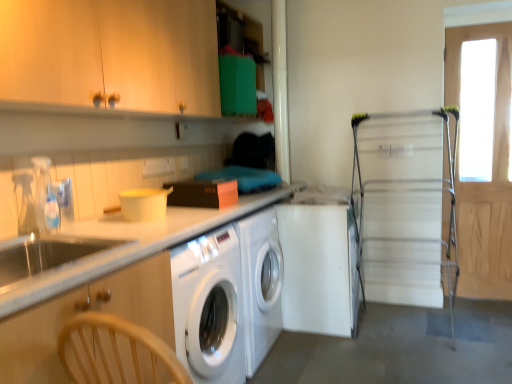
What do you see at coordinates (319, 262) in the screenshot? I see `white matte washing machine at center` at bounding box center [319, 262].

Where is `white glossy countertop at left`? white glossy countertop at left is located at coordinates (128, 246).

Where is `wooden cabinet at upper left, which is the first cabinetry from top to bottom`? This screenshot has height=384, width=512. wooden cabinet at upper left, which is the first cabinetry from top to bottom is located at coordinates (111, 53).

Measure the distance between wooden cabinet at upper left, which is the first cabinetry from top to bottom, and camera.

wooden cabinet at upper left, which is the first cabinetry from top to bottom, is 4.14 feet away from camera.

Describe the element at coordinates (88, 309) in the screenshot. I see `wooden cabinet at left, marked as the second cabinetry in a top-to-bottom arrangement` at that location.

This screenshot has height=384, width=512. What do you see at coordinates (484, 182) in the screenshot?
I see `wooden screen door at right, placed as the second screen door when sorted from left to right` at bounding box center [484, 182].

I want to click on clear plastic faucet at left, so click(x=45, y=197).

Would you consider white glossy countertop at left to be distant from white matte washing machine at center?

No, there isn't a large distance between white glossy countertop at left and white matte washing machine at center.

Is white glossy countertop at left facing towards white matte washing machine at center?

No, white glossy countertop at left does not turn towards white matte washing machine at center.

Does point (53, 281) appear closer or farther from the camera than point (340, 302)?

Point (53, 281) appears to be closer to the viewer than point (340, 302).

Which is behind, white glossy countertop at left or white matte washing machine at center?

white matte washing machine at center is more distant.

Is wooden cabinet at upper left, which is the first cabinetry from top to bottom, looking in the opposite direction of white matte washing machine at center?

No, white matte washing machine at center is not at the back of wooden cabinet at upper left, which is the first cabinetry from top to bottom.

From the picture: From the image's perspective, which one is positioned higher, wooden cabinet at upper left, acting as the second cabinetry starting from the bottom, or white matte washing machine at center?

wooden cabinet at upper left, acting as the second cabinetry starting from the bottom, appears higher in the image.

From a real-world perspective, who is located higher, wooden cabinet at upper left, acting as the second cabinetry starting from the bottom, or white matte washing machine at center?

wooden cabinet at upper left, acting as the second cabinetry starting from the bottom.

Can metallic silver drying rack at right, which appears as the second screen door when viewed from the right, be found inside wooden cabinet at upper left, which is the first cabinetry from top to bottom?

No, metallic silver drying rack at right, which appears as the second screen door when viewed from the right, is located outside of wooden cabinet at upper left, which is the first cabinetry from top to bottom.

Which object is closer to the camera, wooden cabinet at upper left, which is the first cabinetry from top to bottom, or metallic silver drying rack at right, placed as the 1th screen door when sorted from left to right?

wooden cabinet at upper left, which is the first cabinetry from top to bottom, is more forward.

Does clear plastic faucet at left have a greater width compared to white glossy countertop at left?

Incorrect, the width of clear plastic faucet at left does not surpass that of white glossy countertop at left.

Between clear plastic faucet at left and white glossy countertop at left, which one has smaller size?

Smaller between the two is clear plastic faucet at left.

From the image's perspective, is clear plastic faucet at left located above white glossy countertop at left?

Correct, clear plastic faucet at left appears higher than white glossy countertop at left in the image.

Is clear plastic faucet at left positioned with its back to white glossy countertop at left?

That's not correct — clear plastic faucet at left is not looking away from white glossy countertop at left.

Between wooden cabinet at left, marked as the second cabinetry in a top-to-bottom arrangement, and clear plastic faucet at left, which one has larger width?

With larger width is wooden cabinet at left, marked as the second cabinetry in a top-to-bottom arrangement.

From the image's perspective, is wooden cabinet at left, which appears as the 1th cabinetry when ordered from the bottom, positioned above or below clear plastic faucet at left?

From the image's perspective, wooden cabinet at left, which appears as the 1th cabinetry when ordered from the bottom, appears below clear plastic faucet at left.

Which of these two, wooden cabinet at left, marked as the second cabinetry in a top-to-bottom arrangement, or clear plastic faucet at left, stands shorter?

clear plastic faucet at left.

Does point (316, 201) come farther from viewer compared to point (508, 150)?

Yes, point (316, 201) is farther from viewer.

Which is in front, white matte washing machine at center or wooden screen door at right, placed as the second screen door when sorted from left to right?

white matte washing machine at center is in front.

From the image's perspective, is white matte washing machine at center above wooden screen door at right, which is the first screen door in right-to-left order?

Actually, white matte washing machine at center appears below wooden screen door at right, which is the first screen door in right-to-left order, in the image.

Is white matte washing machine at center with wooden screen door at right, placed as the second screen door when sorted from left to right?

white matte washing machine at center is not next to wooden screen door at right, placed as the second screen door when sorted from left to right, and they're not touching.

Are wooden cabinet at upper left, which is the first cabinetry from top to bottom, and wooden screen door at right, which is the first screen door in right-to-left order, making contact?

No, wooden cabinet at upper left, which is the first cabinetry from top to bottom, is not with wooden screen door at right, which is the first screen door in right-to-left order.

From a real-world perspective, which is physically below, wooden cabinet at upper left, acting as the second cabinetry starting from the bottom, or wooden screen door at right, which is the first screen door in right-to-left order?

wooden screen door at right, which is the first screen door in right-to-left order, from a real-world perspective.

Between wooden cabinet at upper left, acting as the second cabinetry starting from the bottom, and wooden screen door at right, which is the first screen door in right-to-left order, which one has smaller size?

wooden screen door at right, which is the first screen door in right-to-left order.

Is wooden cabinet at upper left, which is the first cabinetry from top to bottom, turned away from wooden screen door at right, which is the first screen door in right-to-left order?

No, wooden cabinet at upper left, which is the first cabinetry from top to bottom,'s orientation is not away from wooden screen door at right, which is the first screen door in right-to-left order.

This screenshot has width=512, height=384. Find the location of `countertop in front of the white matte washing machine at center`. countertop in front of the white matte washing machine at center is located at coordinates (128, 246).

Find the location of a particular element. This screenshot has height=384, width=512. the 2nd cabinetry positioned above the white matte washing machine at center (from a real-world perspective) is located at coordinates (111, 53).

When comparing their distances from white glossy countertop at left, does wooden cabinet at left, marked as the second cabinetry in a top-to-bottom arrangement, or wooden screen door at right, which is the first screen door in right-to-left order, seem further?

wooden screen door at right, which is the first screen door in right-to-left order.

Based on their spatial positions, is clear plastic faucet at left or white matte washing machine at center closer to white glossy countertop at left?

The object closer to white glossy countertop at left is clear plastic faucet at left.

Looking at this image, estimate the real-world distances between objects in this image. Which object is further from clear plastic faucet at left, wooden screen door at right, placed as the second screen door when sorted from left to right, or wooden cabinet at upper left, acting as the second cabinetry starting from the bottom?

wooden screen door at right, placed as the second screen door when sorted from left to right.

Considering their positions, is wooden cabinet at upper left, which is the first cabinetry from top to bottom, positioned closer to clear plastic faucet at left than wooden cabinet at left, which appears as the 1th cabinetry when ordered from the bottom?

wooden cabinet at left, which appears as the 1th cabinetry when ordered from the bottom.

Looking at the image, which one is located further to white glossy countertop at left, clear plastic faucet at left or metallic silver drying rack at right, placed as the 1th screen door when sorted from left to right?

Based on the image, metallic silver drying rack at right, placed as the 1th screen door when sorted from left to right, appears to be further to white glossy countertop at left.

Considering their positions, is white matte washing machine at center positioned further to wooden screen door at right, placed as the second screen door when sorted from left to right, than clear plastic faucet at left?

clear plastic faucet at left is positioned further to the anchor wooden screen door at right, placed as the second screen door when sorted from left to right.

Looking at this image, considering their positions, is clear plastic faucet at left positioned further to wooden cabinet at left, marked as the second cabinetry in a top-to-bottom arrangement, than wooden screen door at right, placed as the second screen door when sorted from left to right?

wooden screen door at right, placed as the second screen door when sorted from left to right, is further to wooden cabinet at left, marked as the second cabinetry in a top-to-bottom arrangement.

Considering their positions, is clear plastic faucet at left positioned further to wooden screen door at right, which is the first screen door in right-to-left order, than white matte washing machine at center?

clear plastic faucet at left.

Where is `countertop located between wooden cabinet at upper left, acting as the second cabinetry starting from the bottom, and wooden screen door at right, which is the first screen door in right-to-left order, in the left-right direction`? The image size is (512, 384). countertop located between wooden cabinet at upper left, acting as the second cabinetry starting from the bottom, and wooden screen door at right, which is the first screen door in right-to-left order, in the left-right direction is located at coordinates (128, 246).

Identify the location of faucet between wooden cabinet at upper left, acting as the second cabinetry starting from the bottom, and wooden cabinet at left, marked as the second cabinetry in a top-to-bottom arrangement, in the vertical direction. (45, 197).

Image resolution: width=512 pixels, height=384 pixels. In order to click on screen door located between white matte washing machine at center and wooden screen door at right, placed as the second screen door when sorted from left to right, in the left-right direction in this screenshot , I will do `click(400, 206)`.

Locate an element on the screen. This screenshot has width=512, height=384. screen door between wooden cabinet at upper left, acting as the second cabinetry starting from the bottom, and white matte washing machine at center from front to back is located at coordinates (400, 206).